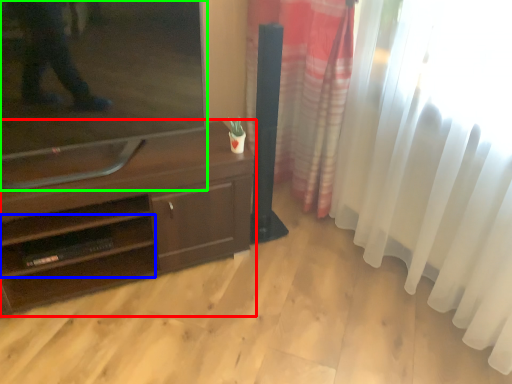
Question: Considering the real-world distances, which object is farthest from desk (highlighted by a red box)? shelf (highlighted by a blue box) or television (highlighted by a green box)?

Choices:
 (A) shelf
 (B) television

Answer: (B)